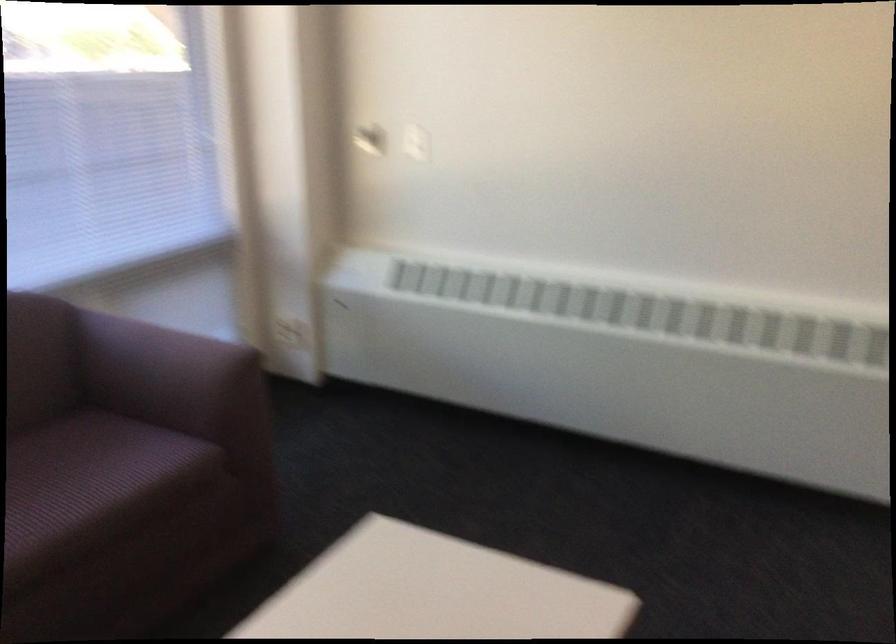
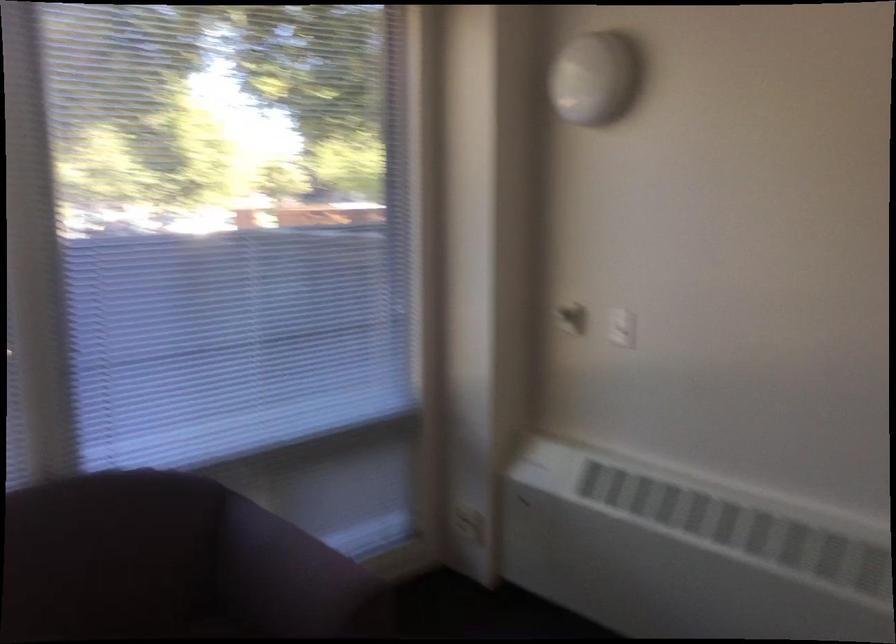
Question: The camera is either moving clockwise (left) or counter-clockwise (right) around the object. The first image is from the beginning of the video and the second image is from the end. Is the camera moving left or right when shooting the video?

Choices:
 (A) Left
 (B) Right

Answer: (B)